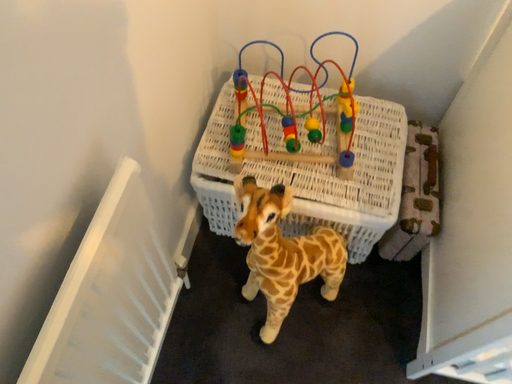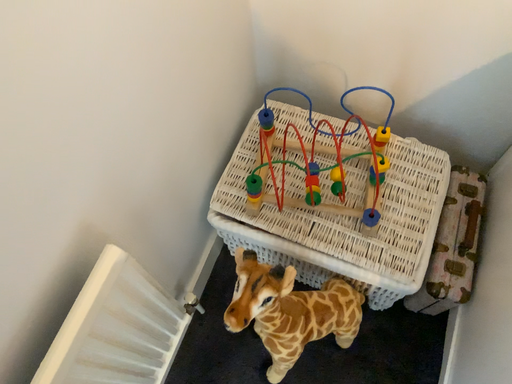
Question: How did the camera likely rotate when shooting the video?

Choices:
 (A) rotated right
 (B) rotated left

Answer: (B)